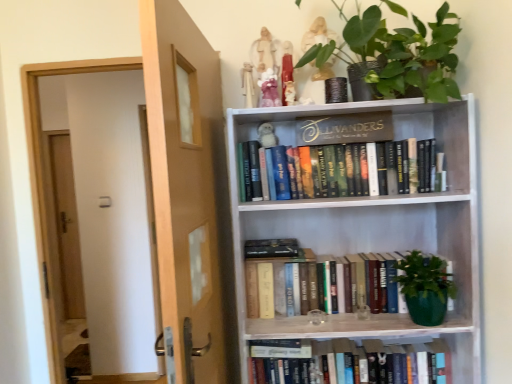
Where is `empty space that is ontop of gold metallic sign at upper center (from a real-world perspective)`? The height and width of the screenshot is (384, 512). empty space that is ontop of gold metallic sign at upper center (from a real-world perspective) is located at coordinates (342, 115).